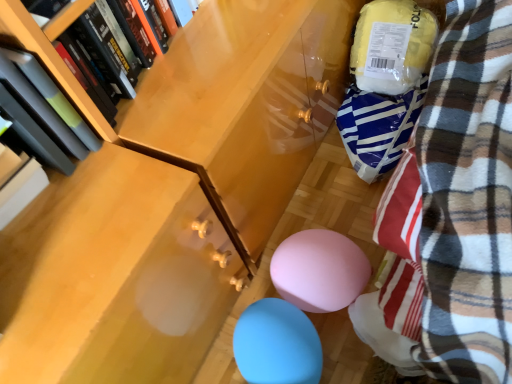
Question: From a real-world perspective, is blue rubber balloon at lower center positioned above or below matte black book at left, the 2th book viewed from the right?

Choices:
 (A) above
 (B) below

Answer: (B)

Question: Is blue rubber balloon at lower center in front of or behind matte black book at left, arranged as the first book when viewed from the left, in the image?

Choices:
 (A) behind
 (B) front

Answer: (A)

Question: Which object is the closest to the hardcover book at upper left, which appears as the 2th book when viewed from the left?

Choices:
 (A) matte black book at left, arranged as the first book when viewed from the left
 (B) blue rubber balloon at lower center

Answer: (A)

Question: Which object is the closest to the matte black book at left, the 2th book viewed from the right?

Choices:
 (A) blue rubber balloon at lower center
 (B) hardcover book at upper left, which appears as the 2th book when viewed from the left

Answer: (B)